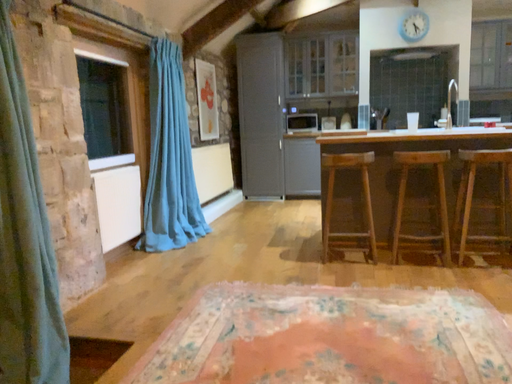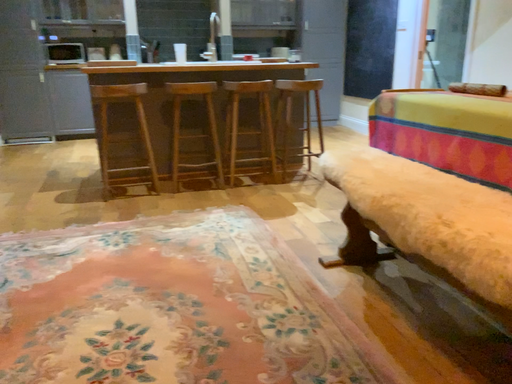
Question: How did the camera likely rotate when shooting the video?

Choices:
 (A) rotated right
 (B) rotated left

Answer: (A)